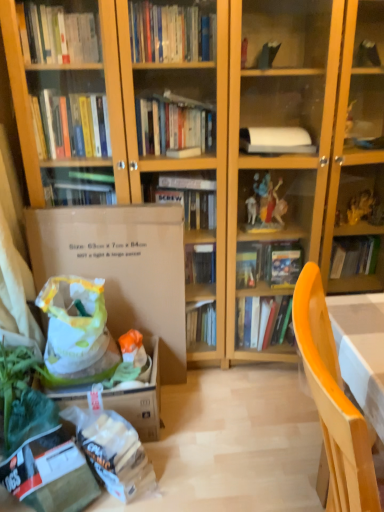
Find the location of a particular element. This screenshot has width=384, height=512. wooden chair at lower right is located at coordinates (333, 402).

This screenshot has height=512, width=384. Identify the location of white plastic grocery bag at lower left. (74, 323).

Where is `wooden chair at lower right`? The height and width of the screenshot is (512, 384). wooden chair at lower right is located at coordinates (333, 402).

Who is more distant, brown cardboard box at left or white plastic grocery bag at lower left?

brown cardboard box at left is more distant.

Does point (69, 213) come behind point (75, 292)?

Yes, it is.

Looking at this image, between brown cardboard box at left and wooden chair at lower right, which one has larger size?

Bigger between the two is wooden chair at lower right.

Which object is wider, brown cardboard box at left or wooden chair at lower right?

wooden chair at lower right.

Which is in front, point (149, 249) or point (354, 420)?

Point (354, 420)

Is brown cardboard box at left at the left side of wooden chair at lower right?

Yes.

Locate an element on the screen. grocery bag below the brown cardboard box at left (from a real-world perspective) is located at coordinates (74, 323).

Based on their sizes in the image, would you say white plastic grocery bag at lower left is bigger or smaller than brown cardboard box at left?

Considering their sizes, white plastic grocery bag at lower left takes up less space than brown cardboard box at left.

Is white plastic grocery bag at lower left surrounding brown cardboard box at left?

Actually, brown cardboard box at left is outside white plastic grocery bag at lower left.

Is white plastic grocery bag at lower left facing away from brown cardboard box at left?

Yes, white plastic grocery bag at lower left is positioned with its back facing brown cardboard box at left.

Can you confirm if wooden chair at lower right is bigger than brown cardboard box at left?

Correct, wooden chair at lower right is larger in size than brown cardboard box at left.

How much distance is there between wooden chair at lower right and brown cardboard box at left?

wooden chair at lower right and brown cardboard box at left are 3.65 feet apart from each other.

Is wooden chair at lower right situated inside brown cardboard box at left or outside?

wooden chair at lower right is not inside brown cardboard box at left, it's outside.

Is wooden chair at lower right not close to brown cardboard box at left?

Yes.

How different are the orientations of wooden chair at lower right and white plastic grocery bag at lower left in degrees?

They differ by 61 degrees in their facing directions.

Which object is closer to the camera, wooden chair at lower right or white plastic grocery bag at lower left?

wooden chair at lower right is closer to the camera.

Looking at this image, is wooden chair at lower right taller or shorter than white plastic grocery bag at lower left?

Considering their sizes, wooden chair at lower right has more height than white plastic grocery bag at lower left.

Is wooden chair at lower right inside the boundaries of white plastic grocery bag at lower left, or outside?

wooden chair at lower right is located beyond the bounds of white plastic grocery bag at lower left.

Consider the image. From a real-world perspective, is white plastic grocery bag at lower left located higher than wooden chair at lower right?

No, from a real-world perspective, white plastic grocery bag at lower left is not on top of wooden chair at lower right.

In the scene shown: Which object is further away from the camera, white plastic grocery bag at lower left or wooden chair at lower right?

white plastic grocery bag at lower left is further from the camera.

Considering the points (61, 336) and (295, 293), which point is behind, point (61, 336) or point (295, 293)?

Positioned behind is point (61, 336).

Is white plastic grocery bag at lower left touching wooden chair at lower right?

white plastic grocery bag at lower left and wooden chair at lower right are clearly separated.

The height and width of the screenshot is (512, 384). Find the location of `paperback book on the right of white plastic grocery bag at lower left`. paperback book on the right of white plastic grocery bag at lower left is located at coordinates (121, 267).

Locate an element on the screen. The height and width of the screenshot is (512, 384). paperback book behind the wooden chair at lower right is located at coordinates (121, 267).

From the image, which object appears to be farther from white plastic grocery bag at lower left, wooden chair at lower right or brown cardboard box at left?

wooden chair at lower right is further to white plastic grocery bag at lower left.

Considering their positions, is brown cardboard box at left positioned further to wooden chair at lower right than white plastic grocery bag at lower left?

brown cardboard box at left is further to wooden chair at lower right.

Looking at the image, which one is located further to brown cardboard box at left, wooden chair at lower right or white plastic grocery bag at lower left?

wooden chair at lower right lies further to brown cardboard box at left than the other object.

Considering their positions, is white plastic grocery bag at lower left positioned further to wooden chair at lower right than brown cardboard box at left?

Based on the image, brown cardboard box at left appears to be further to wooden chair at lower right.

Looking at the image, which one is located further to brown cardboard box at left, white plastic grocery bag at lower left or wooden chair at lower right?

wooden chair at lower right is positioned further to the anchor brown cardboard box at left.

Based on their spatial positions, is brown cardboard box at left or wooden chair at lower right closer to white plastic grocery bag at lower left?

Based on the image, brown cardboard box at left appears to be nearer to white plastic grocery bag at lower left.

This screenshot has width=384, height=512. I want to click on grocery bag positioned between wooden chair at lower right and brown cardboard box at left from near to far, so (74, 323).